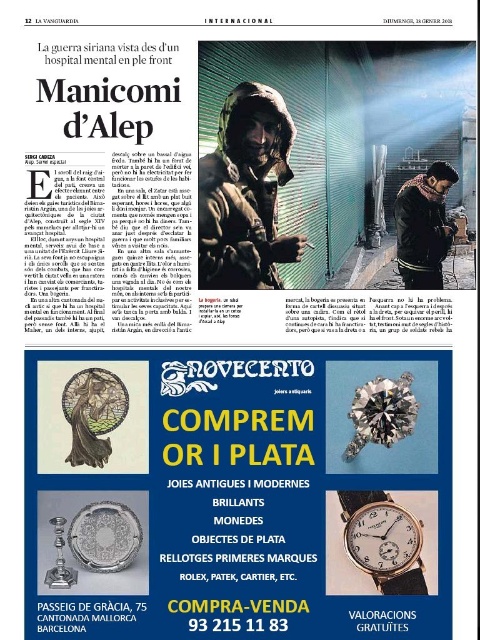
Is gold/brass watch at center taller than dark wool scarf at upper right?

Incorrect, gold/brass watch at center's height is not larger of dark wool scarf at upper right's.

Is point (372, 557) behind point (407, 198)?

No, (372, 557) is closer to viewer.

The width and height of the screenshot is (480, 640). What are the coordinates of `gold/brass watch at center` in the screenshot? It's located at (384, 540).

Between matte black jacket at center and dark wool scarf at upper right, which one is positioned higher?

dark wool scarf at upper right is higher up.

Is the position of matte black jacket at center less distant than that of dark wool scarf at upper right?

Yes, matte black jacket at center is in front of dark wool scarf at upper right.

This screenshot has height=640, width=480. Describe the element at coordinates (245, 193) in the screenshot. I see `matte black jacket at center` at that location.

Find the location of `matte black jacket at center`. matte black jacket at center is located at coordinates (245, 193).

Is matte black jacket at center taller than gold/brass watch at center?

Yes, matte black jacket at center is taller than gold/brass watch at center.

Identify the location of matte black jacket at center. The height and width of the screenshot is (640, 480). (245, 193).

Who is more forward, (295, 237) or (355, 528)?

Point (355, 528)

What are the coordinates of `matte black jacket at center` in the screenshot? It's located at (245, 193).